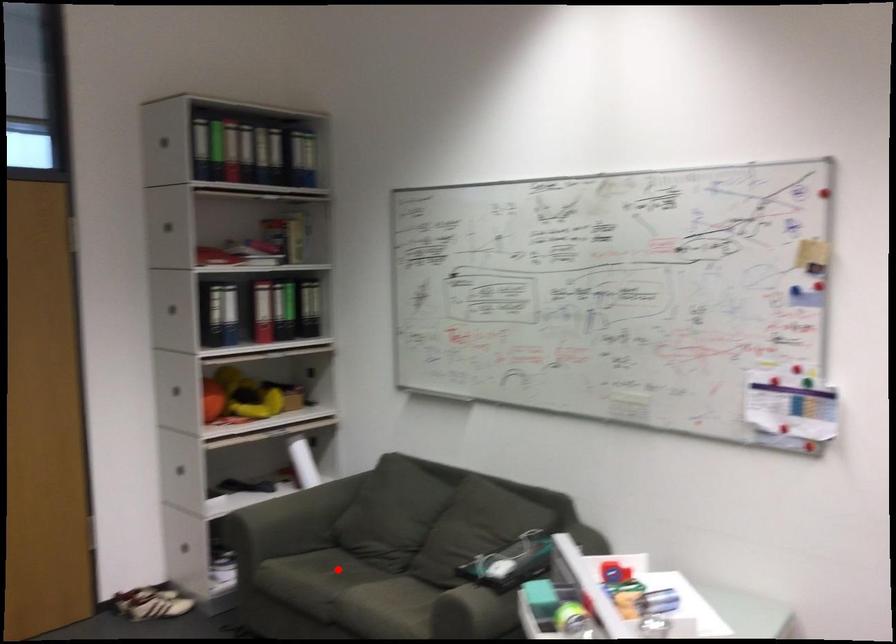
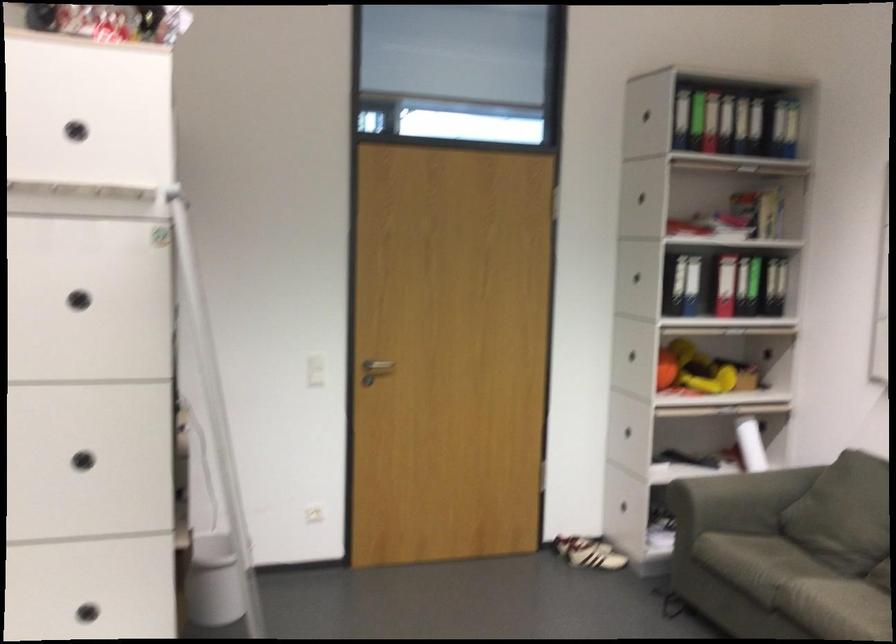
In the second image, find the point that corresponds to the highlighted location in the first image.

(787, 550)